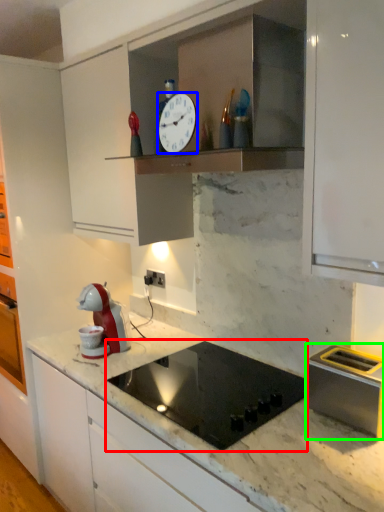
Question: Which object is positioned closest to gas stove (highlighted by a red box)? Select from clock (highlighted by a blue box) and kitchen appliance (highlighted by a green box).

Choices:
 (A) clock
 (B) kitchen appliance

Answer: (B)